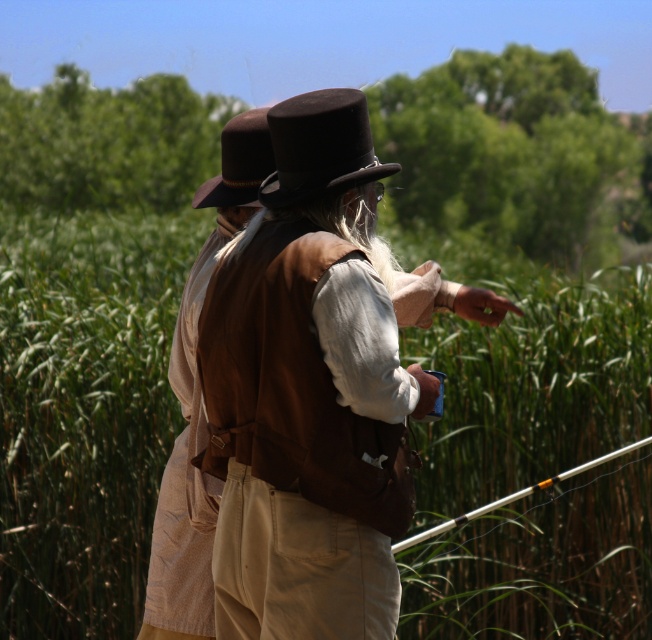
Question: Estimate the real-world distances between objects in this image. Which object is closer to the brown felt hat at upper center?

Choices:
 (A) brown leather vest at center
 (B) matte brown hat at center

Answer: (A)

Question: Estimate the real-world distances between objects in this image. Which object is closer to the matte brown hat at center?

Choices:
 (A) brown felt hat at upper center
 (B) metallic silver fishing pole at right
 (C) brown leather vest at center

Answer: (A)

Question: Can you confirm if brown leather vest at center is positioned to the right of matte brown hat at center?

Choices:
 (A) yes
 (B) no

Answer: (B)

Question: Which object is the farthest from the brown leather vest at center?

Choices:
 (A) green grass at center
 (B) brown felt hat at upper center
 (C) matte brown hat at center

Answer: (A)

Question: Is the position of brown felt hat at upper center more distant than that of metallic silver fishing pole at right?

Choices:
 (A) no
 (B) yes

Answer: (B)

Question: Can you confirm if green grass at center is positioned to the right of brown felt hat at upper center?

Choices:
 (A) yes
 (B) no

Answer: (A)